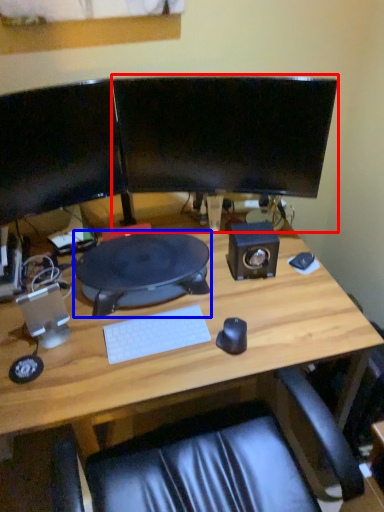
Question: Which object appears closest to the camera in this image, computer monitor (highlighted by a red box) or desktop (highlighted by a blue box)?

Choices:
 (A) computer monitor
 (B) desktop

Answer: (A)